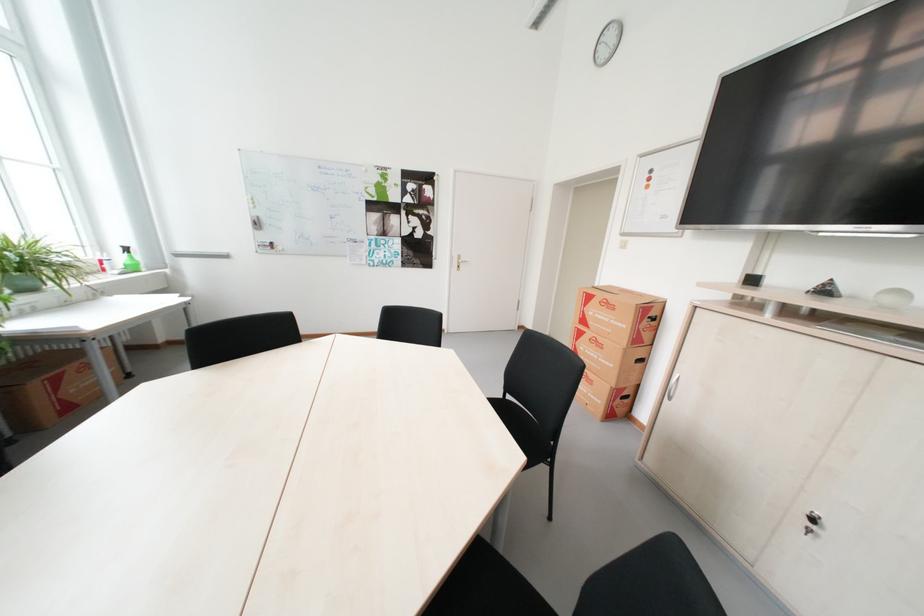
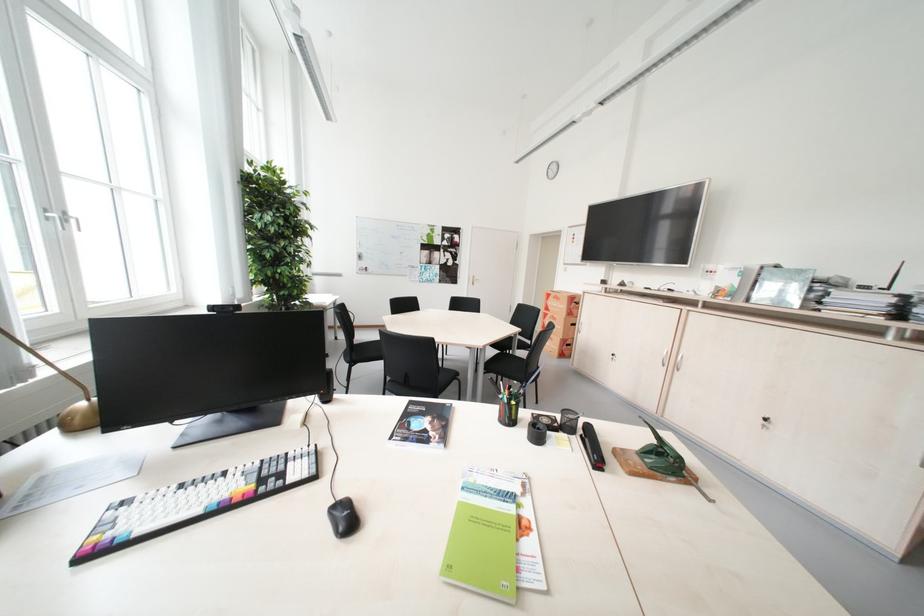
Question: I am providing you with two images of the same scene from different viewpoints. Please identify which objects are invisible in image2.

Choices:
 (A) spray bottle trigger
 (B) range hood slider
 (C) green press handle
 (D) cardboard box

Answer: (A)